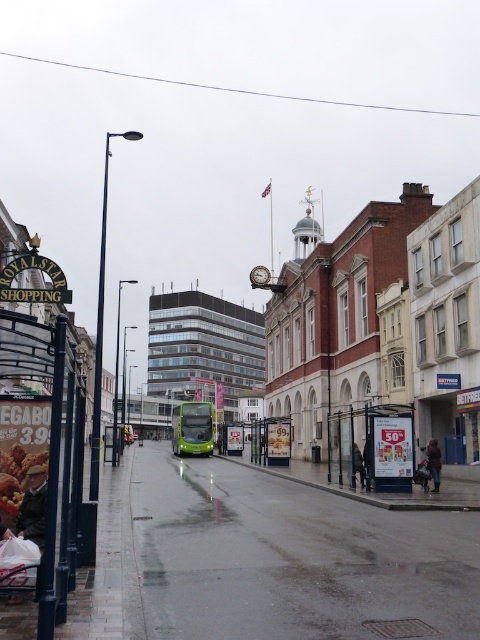
Describe the element at coordinates (292, 557) in the screenshot. Image resolution: width=480 pixels, height=640 pixels. I see `concrete pavement at lower left` at that location.

Does concrete pavement at lower left have a larger size compared to green glass bus at center?

Indeed, concrete pavement at lower left has a larger size compared to green glass bus at center.

This screenshot has width=480, height=640. Identify the location of concrete pavement at lower left. (292, 557).

Based on the photo, who is shorter, concrete pavement at lower left or metallic signboard at left?

metallic signboard at left

Can you confirm if concrete pavement at lower left is wider than metallic signboard at left?

Correct, the width of concrete pavement at lower left exceeds that of metallic signboard at left.

Is point (269, 557) more distant than point (67, 468)?

Yes, it is behind point (67, 468).

The height and width of the screenshot is (640, 480). I want to click on concrete pavement at lower left, so click(292, 557).

Does green glass bus at center have a smaller size compared to green metallic bus at center?

Yes.

Between green glass bus at center and green metallic bus at center, which one is positioned lower?

green metallic bus at center is below.

Which is in front, point (349, 445) or point (184, 451)?

Positioned in front is point (349, 445).

You are a GUI agent. You are given a task and a screenshot of the screen. Output one action in this format:
    pyautogui.click(x=<x>, y=<y>)
    Task: Click on the green glass bus at center
    This screenshot has height=640, width=480.
    Given the screenshot: What is the action you would take?
    pyautogui.click(x=372, y=445)